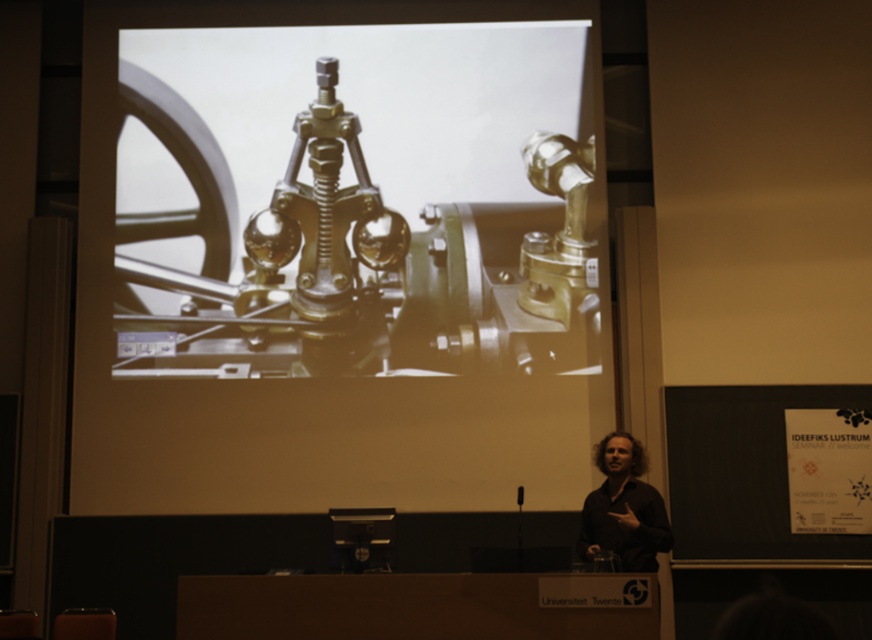
You are an attendee at the presentation and want to see both the gold metallic machinery at center and the dark brown hair at lower right. Which one is located higher in the image?

The gold metallic machinery at center is positioned over dark brown hair at lower right, so it is higher in the image.

You are an attendee at the presentation and want to know if the gold metallic machinery at center is wider than the dark brown hair at lower right. Can you confirm this based on the scene?

The gold metallic machinery at center is wider than dark brown hair at lower right, so yes, the gold metallic machinery at center is indeed wider than the dark brown hair at lower right.

You are an attendee sitting in the front row of the presentation. You notice the gold metallic machinery at center and the dark brown hair at lower right. Which object is closer to you?

The gold metallic machinery at center is closer to you than the dark brown hair at lower right because it is positioned further to the viewer.